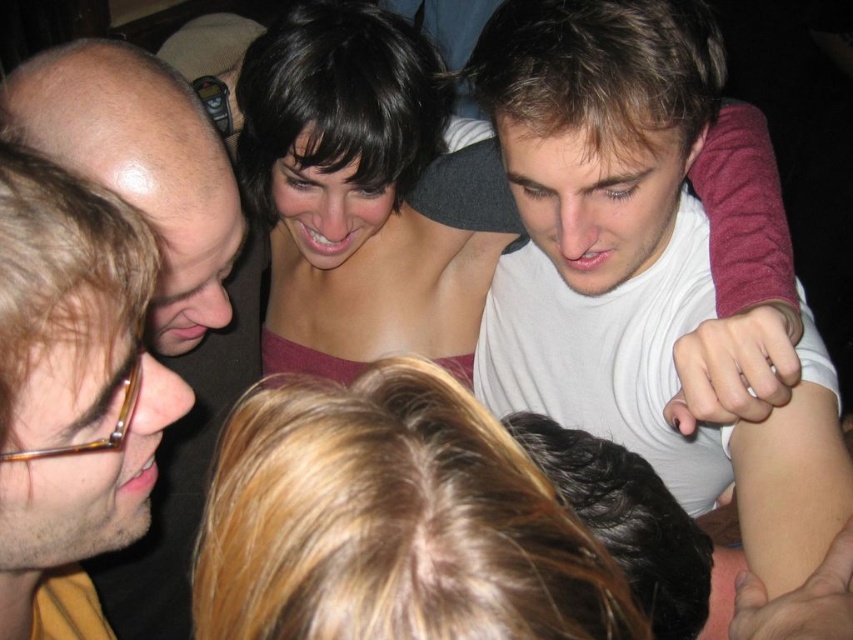
Based on the scene description, which object is positioned lower in the image between the blonde hair at center and the matte pink dress at center?

The blonde hair at center is located below the matte pink dress at center, so it is positioned lower in the image.

You are a photographer at this gathering and want to capture a candid shot of both the blonde hair at center and the matte pink dress at center in the same frame. Considering their distance, is it possible to include both in a single photo without moving either subject?

The blonde hair at center and the matte pink dress at center are 28.46 inches apart. Depending on the camera lens and framing, it may be possible to capture both in one shot if the camera angle can encompass this distance. However, without knowing the camera specifications, a definitive answer isn

You are standing in the room and want to move from the point at coordinates point [259,586] to the point at coordinates point [192,156]. Which direction should you move to get closer to your destination?

You should move towards the point at coordinates point [192,156], which is farther away from you than the starting point at point [259,586]. Since the destination is farther, you need to move in the direction away from the viewer to reach it.